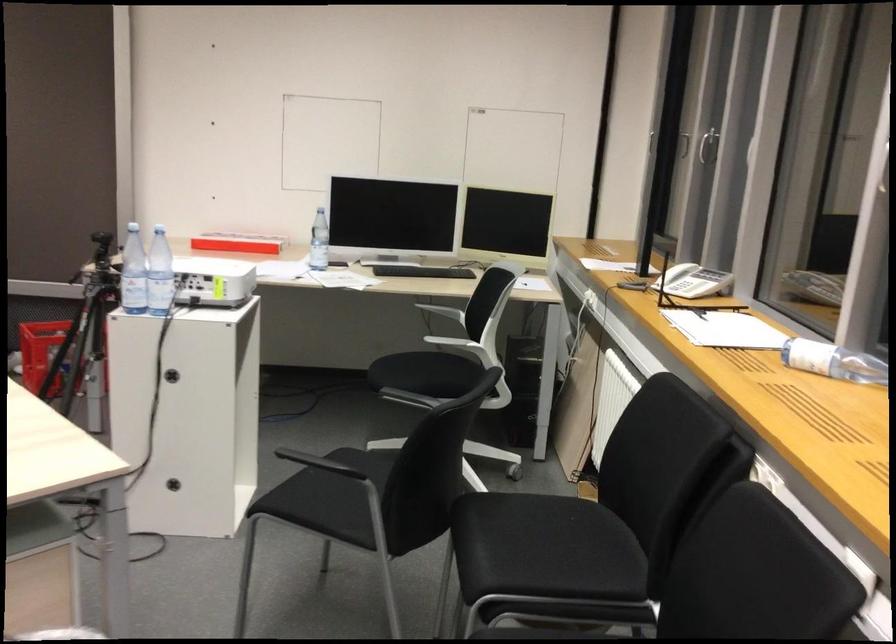
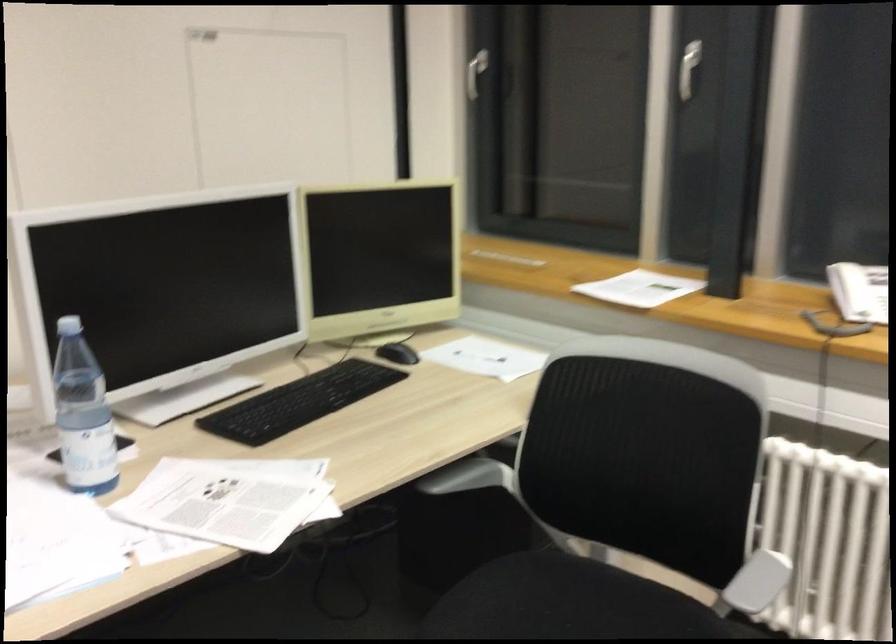
Find the pixel in the second image that matches point (443, 366) in the first image.

(570, 603)